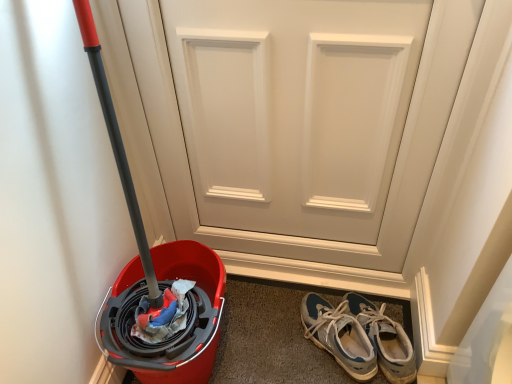
Where is `blue suede sneakers at lower right, the second footwear from the right`? This screenshot has height=384, width=512. blue suede sneakers at lower right, the second footwear from the right is located at coordinates (339, 336).

Is blue suede sneakers at lower right, the second footwear from the right, placed right next to white matte door at center?

blue suede sneakers at lower right, the second footwear from the right, is not next to white matte door at center, and they're not touching.

Between blue suede sneakers at lower right, the 1th footwear positioned from the left, and white matte door at center, which one is positioned in front?

white matte door at center is more forward.

From a real-world perspective, is blue suede sneakers at lower right, the 1th footwear positioned from the left, above or below white matte door at center?

blue suede sneakers at lower right, the 1th footwear positioned from the left, is situated lower than white matte door at center in the real world.

Considering the positions of objects blue suede sneakers at lower right, the second footwear from the right, and blue suede sneakers at lower right, which is the 2th footwear in left-to-right order, in the image provided, who is more to the left, blue suede sneakers at lower right, the second footwear from the right, or blue suede sneakers at lower right, which is the 2th footwear in left-to-right order,?

Positioned to the left is blue suede sneakers at lower right, the second footwear from the right.

Looking at this image, how much distance is there between blue suede sneakers at lower right, the 1th footwear positioned from the left, and blue suede sneakers at lower right, the 1th footwear in the right-to-left sequence?

blue suede sneakers at lower right, the 1th footwear positioned from the left, is 2.36 inches from blue suede sneakers at lower right, the 1th footwear in the right-to-left sequence.

From a real-world perspective, relative to blue suede sneakers at lower right, which is the 2th footwear in left-to-right order, is blue suede sneakers at lower right, the 1th footwear positioned from the left, vertically above or below?

Clearly, from a real-world perspective, blue suede sneakers at lower right, the 1th footwear positioned from the left, is above blue suede sneakers at lower right, which is the 2th footwear in left-to-right order.

Is the surface of blue suede sneakers at lower right, the 1th footwear positioned from the left, in direct contact with blue suede sneakers at lower right, which is the 2th footwear in left-to-right order?

Yes, blue suede sneakers at lower right, the 1th footwear positioned from the left, is beside blue suede sneakers at lower right, which is the 2th footwear in left-to-right order.

Which object is further away from the camera, white matte door at center or blue suede sneakers at lower right, which is the 2th footwear in left-to-right order?

blue suede sneakers at lower right, which is the 2th footwear in left-to-right order, is more distant.

Identify the location of door above the blue suede sneakers at lower right, which is the 2th footwear in left-to-right order (from the image's perspective). The height and width of the screenshot is (384, 512). (293, 122).

Is blue suede sneakers at lower right, the 1th footwear in the right-to-left sequence, surrounded by white matte door at center?

Definitely not — blue suede sneakers at lower right, the 1th footwear in the right-to-left sequence, is not inside white matte door at center.

From the image's perspective, which one is positioned higher, blue suede sneakers at lower right, which is the 2th footwear in left-to-right order, or blue suede sneakers at lower right, the second footwear from the right?

blue suede sneakers at lower right, which is the 2th footwear in left-to-right order, is shown above in the image.

Is the position of blue suede sneakers at lower right, which is the 2th footwear in left-to-right order, less distant than that of blue suede sneakers at lower right, the second footwear from the right?

That is False.

Can you confirm if blue suede sneakers at lower right, the 1th footwear in the right-to-left sequence, is positioned to the right of blue suede sneakers at lower right, the second footwear from the right?

Indeed, blue suede sneakers at lower right, the 1th footwear in the right-to-left sequence, is positioned on the right side of blue suede sneakers at lower right, the second footwear from the right.

Is white matte door at center at the right side of blue suede sneakers at lower right, the second footwear from the right?

Incorrect, white matte door at center is not on the right side of blue suede sneakers at lower right, the second footwear from the right.

From the image's perspective, which is below, white matte door at center or blue suede sneakers at lower right, the second footwear from the right?

blue suede sneakers at lower right, the second footwear from the right.

Between white matte door at center and blue suede sneakers at lower right, the 1th footwear positioned from the left, which one has more height?

white matte door at center is taller.

Considering the sizes of objects blue suede sneakers at lower right, which is the 2th footwear in left-to-right order, and white matte door at center in the image provided, who is shorter, blue suede sneakers at lower right, which is the 2th footwear in left-to-right order, or white matte door at center?

blue suede sneakers at lower right, which is the 2th footwear in left-to-right order, is shorter.

Is blue suede sneakers at lower right, the 1th footwear in the right-to-left sequence, bigger or smaller than white matte door at center?

In the image, blue suede sneakers at lower right, the 1th footwear in the right-to-left sequence, appears to be smaller than white matte door at center.

From the image's perspective, would you say blue suede sneakers at lower right, the 1th footwear in the right-to-left sequence, is shown under white matte door at center?

Correct, blue suede sneakers at lower right, the 1th footwear in the right-to-left sequence, appears lower than white matte door at center in the image.

How different are the orientations of blue suede sneakers at lower right, the 1th footwear in the right-to-left sequence, and white matte door at center in degrees?

39.5 degrees.

This screenshot has height=384, width=512. Identify the location of door above the blue suede sneakers at lower right, the second footwear from the right (from the image's perspective). (293, 122).

Identify the location of footwear that appears above the blue suede sneakers at lower right, which is the 2th footwear in left-to-right order (from a real-world perspective). The image size is (512, 384). (339, 336).

Considering their positions, is blue suede sneakers at lower right, which is the 2th footwear in left-to-right order, positioned closer to white matte door at center than blue suede sneakers at lower right, the second footwear from the right?

blue suede sneakers at lower right, the second footwear from the right.

Looking at the image, which one is located closer to white matte door at center, blue suede sneakers at lower right, the 1th footwear positioned from the left, or blue suede sneakers at lower right, which is the 2th footwear in left-to-right order?

blue suede sneakers at lower right, the 1th footwear positioned from the left, is positioned closer to the anchor white matte door at center.

Estimate the real-world distances between objects in this image. Which object is closer to blue suede sneakers at lower right, the 1th footwear in the right-to-left sequence, white matte door at center or blue suede sneakers at lower right, the 1th footwear positioned from the left?

blue suede sneakers at lower right, the 1th footwear positioned from the left.

Based on their spatial positions, is white matte door at center or blue suede sneakers at lower right, which is the 2th footwear in left-to-right order, further from blue suede sneakers at lower right, the second footwear from the right?

white matte door at center is further to blue suede sneakers at lower right, the second footwear from the right.

Estimate the real-world distances between objects in this image. Which object is closer to blue suede sneakers at lower right, the 1th footwear positioned from the left, blue suede sneakers at lower right, the 1th footwear in the right-to-left sequence, or white matte door at center?

Among the two, blue suede sneakers at lower right, the 1th footwear in the right-to-left sequence, is located nearer to blue suede sneakers at lower right, the 1th footwear positioned from the left.

From the image, which object appears to be farther from blue suede sneakers at lower right, which is the 2th footwear in left-to-right order, blue suede sneakers at lower right, the second footwear from the right, or white matte door at center?

The object further to blue suede sneakers at lower right, which is the 2th footwear in left-to-right order, is white matte door at center.

Where is `footwear between white matte door at center and blue suede sneakers at lower right, the second footwear from the right, vertically`? Image resolution: width=512 pixels, height=384 pixels. footwear between white matte door at center and blue suede sneakers at lower right, the second footwear from the right, vertically is located at coordinates (385, 339).